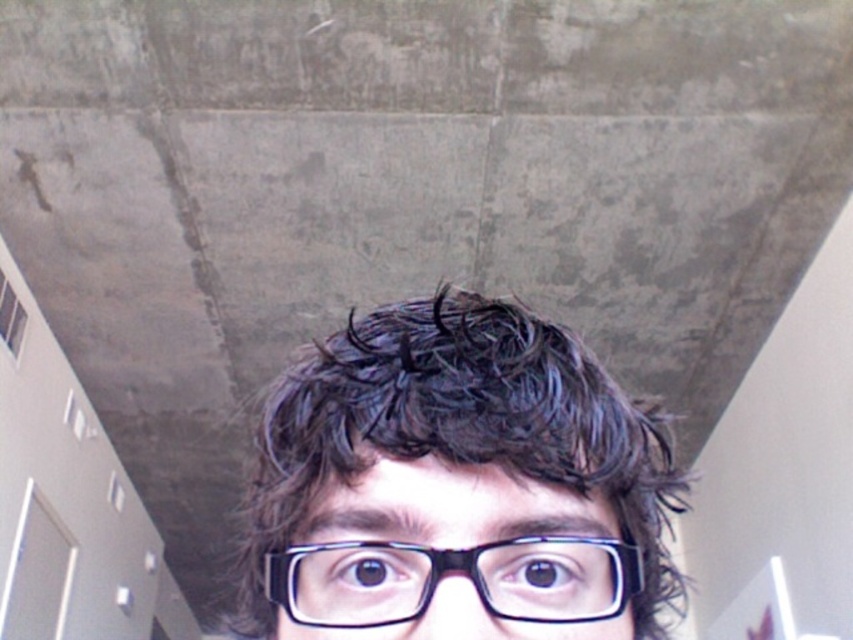
In the scene shown: You are an interior designer assessing the lighting in this room. The black glossy glasses at center are positioned at coordinates 0.759 on the x axis and 0.537 on the y axis. Based on the scene description, would the glasses cast a sharp or blurry shadow on the textured ceiling?

The glasses cast a blurry shadow because the lighting in the scene is described as dim with soft shadows, which typically result in less defined shadows rather than sharp ones.